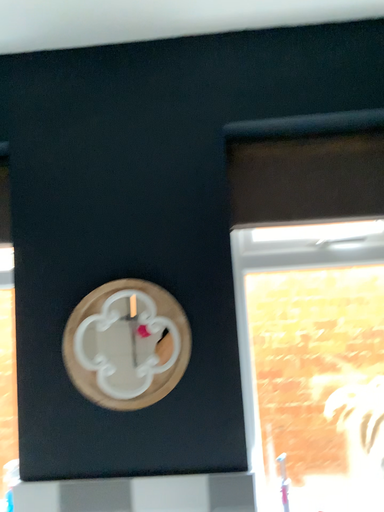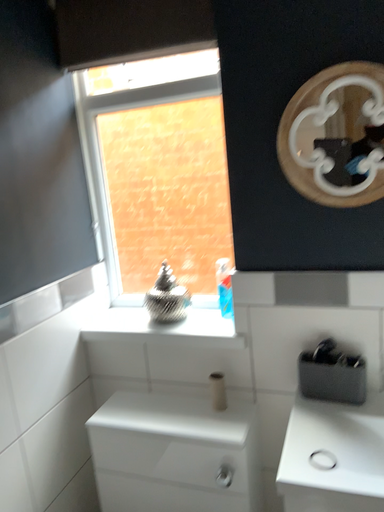
Question: Which way did the camera rotate in the video?

Choices:
 (A) rotated upward
 (B) rotated downward

Answer: (B)